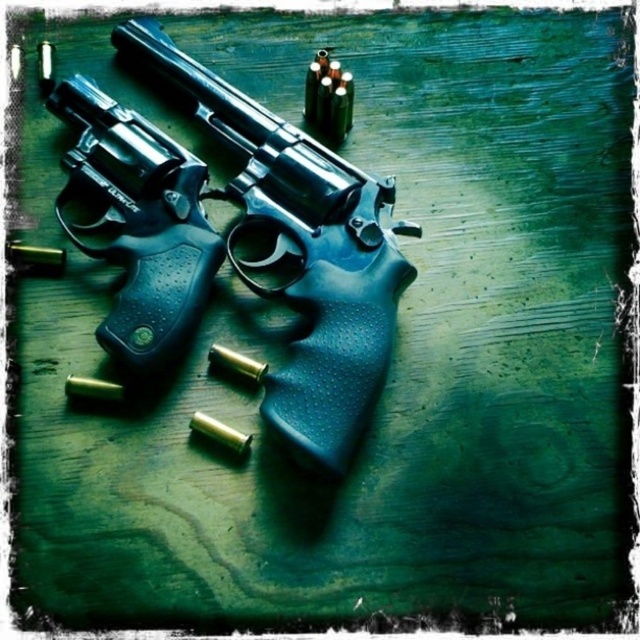
You are a gunsmith examining two revolvers on a wooden table. You need to determine which revolver has a larger width. The revolvers are labeled as the polished metal revolver at center and the matte black revolver at center. Which one has a greater width?

The polished metal revolver at center has a larger width than the matte black revolver at center according to the description.

You are a collector examining two revolvers on a table. You notice the polished metal revolver at center and the matte black revolver at center. Which revolver is positioned closer to you?

The polished metal revolver at center is closer to the viewer than the matte black revolver at center.

You are a collector examining two revolvers on a wooden table. You notice the polished metal revolver at center and the matte black revolver at center. Which revolver is positioned higher in the image?

The polished metal revolver at center is located above the matte black revolver at center, so it is positioned higher in the image.